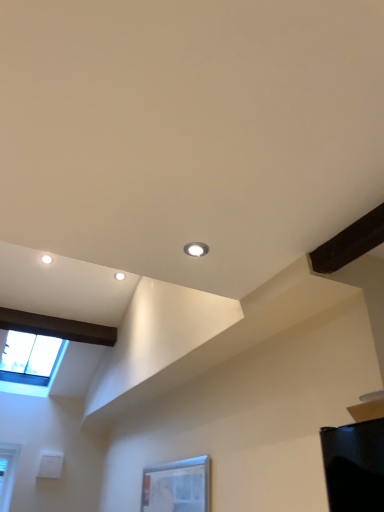
Question: Considering the positions of transparent glass window at upper left, placed as the 1th window when sorted from back to front, and transparent glass window at lower center, which is the 1th window in front-to-back order, in the image, is transparent glass window at upper left, placed as the 1th window when sorted from back to front, wider or thinner than transparent glass window at lower center, which is the 1th window in front-to-back order,?

Choices:
 (A) thin
 (B) wide

Answer: (B)

Question: Is point (29, 390) positioned closer to the camera than point (145, 482)?

Choices:
 (A) farther
 (B) closer

Answer: (A)

Question: Which is farther from the matte white droplight at upper center?

Choices:
 (A) transparent glass window at lower center, the second window when ordered from back to front
 (B) transparent glass window at upper left, which appears as the 2th window when viewed from the front

Answer: (B)

Question: Based on their relative distances, which object is nearer to the matte white droplight at upper center?

Choices:
 (A) transparent glass window at upper left, which appears as the 2th window when viewed from the front
 (B) transparent glass window at lower center, which is the 1th window in front-to-back order

Answer: (B)